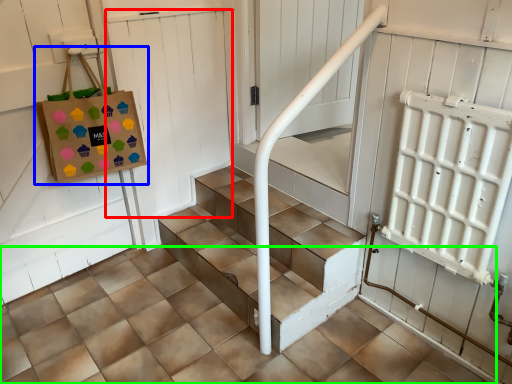
Question: Which object is the farthest from door (highlighted by a red box)? Choose among these: bag (highlighted by a blue box) or concrete (highlighted by a green box).

Choices:
 (A) bag
 (B) concrete

Answer: (B)